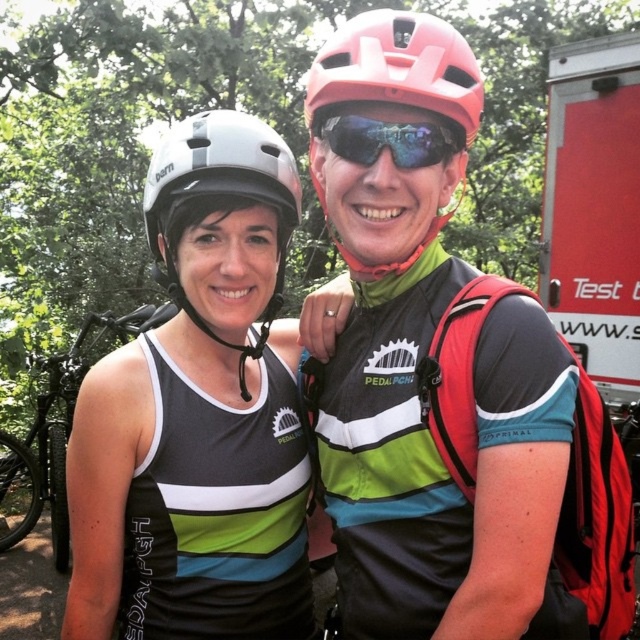
Question: Which point is farther to the camera?

Choices:
 (A) matte black helmet at center
 (B) matte black helmet at upper center
 (C) matte pink helmet at upper center
 (D) matte black bicycle at left

Answer: (D)

Question: Observing the image, what is the correct spatial positioning of matte black helmet at center in reference to white matte helmet at upper left?

Choices:
 (A) below
 (B) above

Answer: (A)

Question: In this image, where is matte pink helmet at upper center located relative to matte black bicycle at left?

Choices:
 (A) below
 (B) above

Answer: (B)

Question: Estimate the real-world distances between objects in this image. Which object is farther from the white matte helmet at upper left?

Choices:
 (A) matte black helmet at upper center
 (B) matte black helmet at center

Answer: (A)

Question: Among these objects, which one is nearest to the camera?

Choices:
 (A) matte black helmet at upper center
 (B) matte pink helmet at upper center
 (C) matte black bicycle at left
 (D) white matte helmet at upper left

Answer: (A)

Question: Is matte black helmet at upper center thinner than matte pink helmet at center?

Choices:
 (A) yes
 (B) no

Answer: (B)